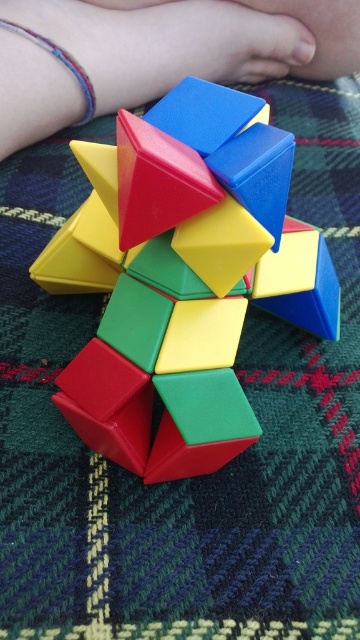
You are trying to solve the puzzle and need to know its exact position on the table. According to the coordinates provided, where is the rubberized plastic puzzle at center located?

The rubberized plastic puzzle at center is located at point coordinates of (182, 276).

You are a delivery robot with a 60 cm wide box to deliver. You need to place the box between the rubberized plastic puzzle at center and the rubberized plastic toy at center. Can you fit the box between them?

The rubberized plastic puzzle at center and rubberized plastic toy at center are 64.83 centimeters apart from each other. Since the box is 60 cm wide, it can fit between them with 4.83 centimeters of space remaining.